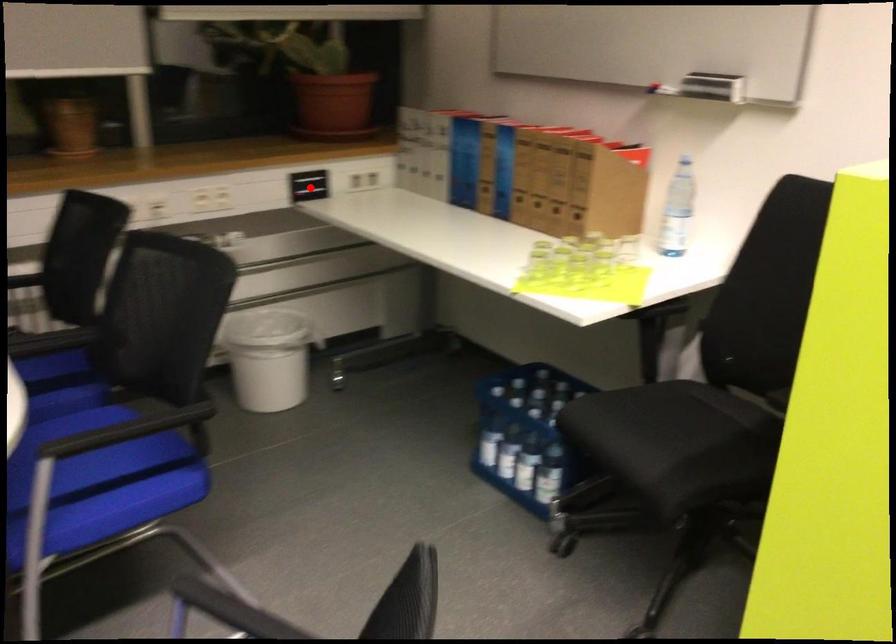
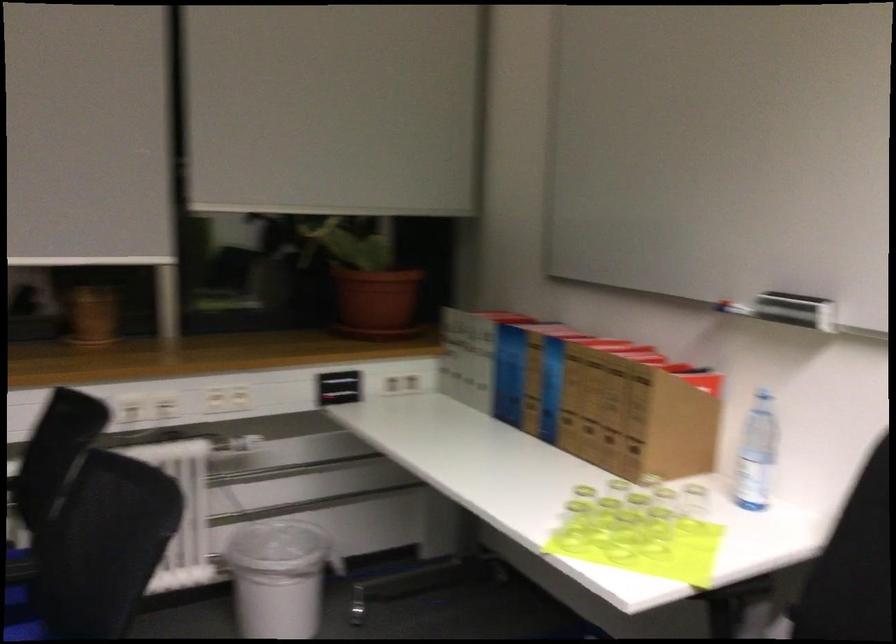
Question: I am providing you with two images of the same scene from different viewpoints. A red point is shown in image1. For the corresponding object point in image2, is it positioned nearer or farther from the camera?

Choices:
 (A) Nearer
 (B) Farther

Answer: (A)